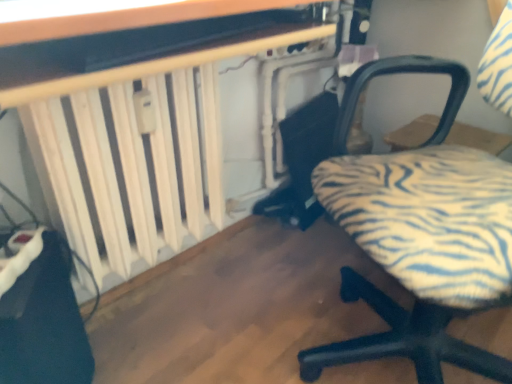
Question: From a real-world perspective, is zebra-patterned fabric chair at lower right above or below white wooden radiator at left, which is the first table in back-to-front order?

Choices:
 (A) below
 (B) above

Answer: (B)

Question: Considering the positions of zebra-patterned fabric chair at lower right and white wooden radiator at left, which is the first table in back-to-front order, in the image, is zebra-patterned fabric chair at lower right taller or shorter than white wooden radiator at left, which is the first table in back-to-front order,?

Choices:
 (A) tall
 (B) short

Answer: (A)

Question: Estimate the real-world distances between objects in this image. Which object is closer to the white wooden radiator at left, which is the first table in back-to-front order?

Choices:
 (A) wooden table at upper center, which is the 2th table from back to front
 (B) zebra-patterned fabric chair at lower right

Answer: (A)

Question: Which is nearer to the white wooden radiator at left, which is the first table in back-to-front order?

Choices:
 (A) wooden table at upper center, which is the 2th table from back to front
 (B) zebra-patterned fabric chair at lower right

Answer: (A)